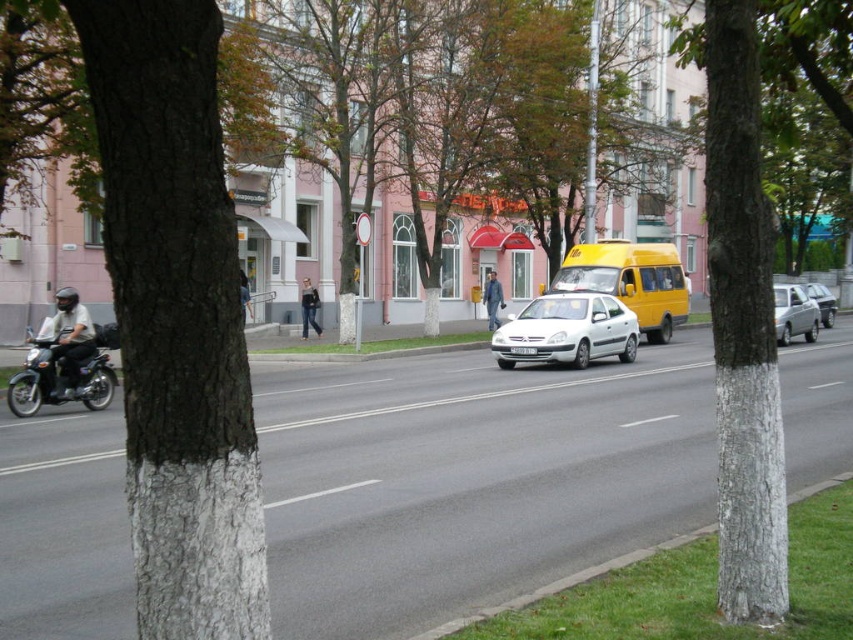
Is point (155, 365) closer to viewer compared to point (302, 326)?

Yes, point (155, 365) is in front of point (302, 326).

Does smooth bark tree at left appear on the right side of denim jeans at center?

Indeed, smooth bark tree at left is positioned on the right side of denim jeans at center.

Is point (228, 333) closer to viewer compared to point (312, 326)?

Yes, it is in front of point (312, 326).

Where is `smooth bark tree at left`? smooth bark tree at left is located at coordinates (177, 317).

Does smooth bark tree at left have a greater width compared to denim pants at center?

No.

Which is above, smooth bark tree at left or denim pants at center?

Positioned higher is denim pants at center.

Is point (180, 38) more distant than point (241, 296)?

No, it is in front of (241, 296).

At what (x,y) coordinates should I click in order to perform the action: click on smooth bark tree at left. Please return your answer as a coordinate pair (x, y). The image size is (853, 640). Looking at the image, I should click on (177, 317).

Can you confirm if silver metallic sedan at right is positioned above silver metallic sedan at center?

Actually, silver metallic sedan at right is below silver metallic sedan at center.

Which is more to the left, silver metallic sedan at right or silver metallic sedan at center?

silver metallic sedan at right

Describe the element at coordinates (793, 314) in the screenshot. This screenshot has width=853, height=640. I see `silver metallic sedan at right` at that location.

Identify the location of silver metallic sedan at right. (793, 314).